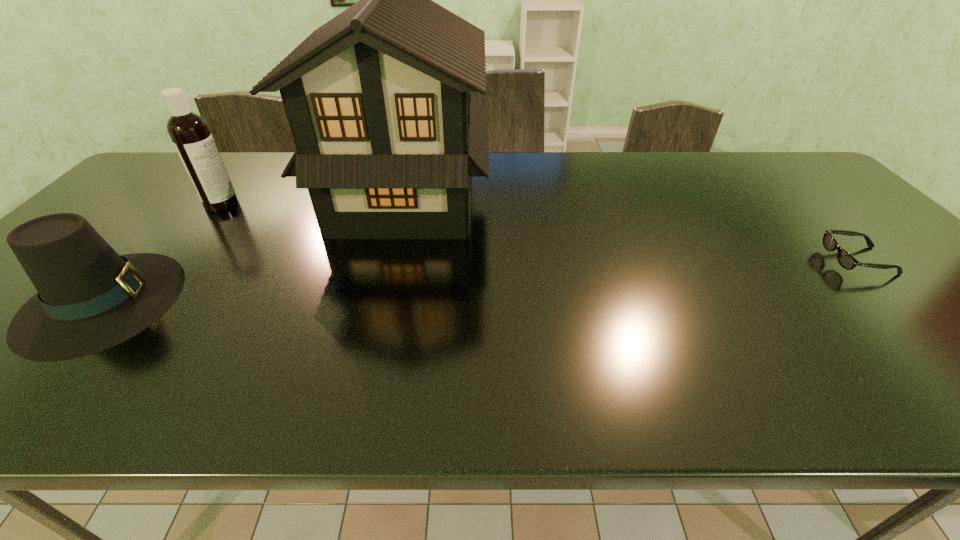
The width and height of the screenshot is (960, 540). What are the coordinates of `object that is at the far edge` in the screenshot? It's located at (387, 134).

You are a GUI agent. You are given a task and a screenshot of the screen. Output one action in this format:
    pyautogui.click(x=<x>, y=<y>)
    Task: Click on the object that is at the right edge
    The width and height of the screenshot is (960, 540).
    Given the screenshot: What is the action you would take?
    pyautogui.click(x=846, y=260)

In the image, there is a desktop. Where is `vacant space at the far edge`? This screenshot has height=540, width=960. vacant space at the far edge is located at coordinates (726, 185).

The image size is (960, 540). Identify the location of vacant area at the far right corner. (762, 168).

Locate an element on the screen. This screenshot has width=960, height=540. free area in between the tallest object and the shortest object is located at coordinates (631, 230).

The width and height of the screenshot is (960, 540). I want to click on vacant area that lies between the second tallest object and the shortest object, so click(540, 232).

Where is `object that stands as the third closest to the shortest object`? object that stands as the third closest to the shortest object is located at coordinates (189, 132).

Where is `the closest object relative to the second tallest object`? The height and width of the screenshot is (540, 960). the closest object relative to the second tallest object is located at coordinates (89, 298).